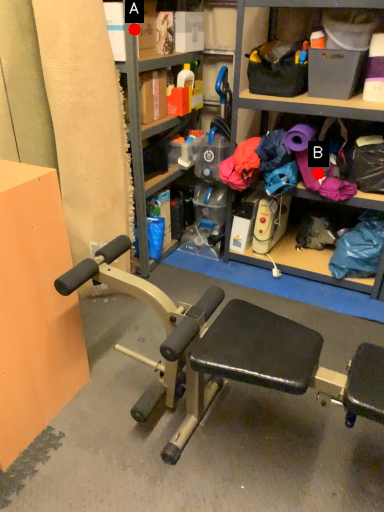
Question: Two points are circled on the image, labeled by A and B beside each circle. Which point is closer to the camera?

Choices:
 (A) A is closer
 (B) B is closer

Answer: (A)